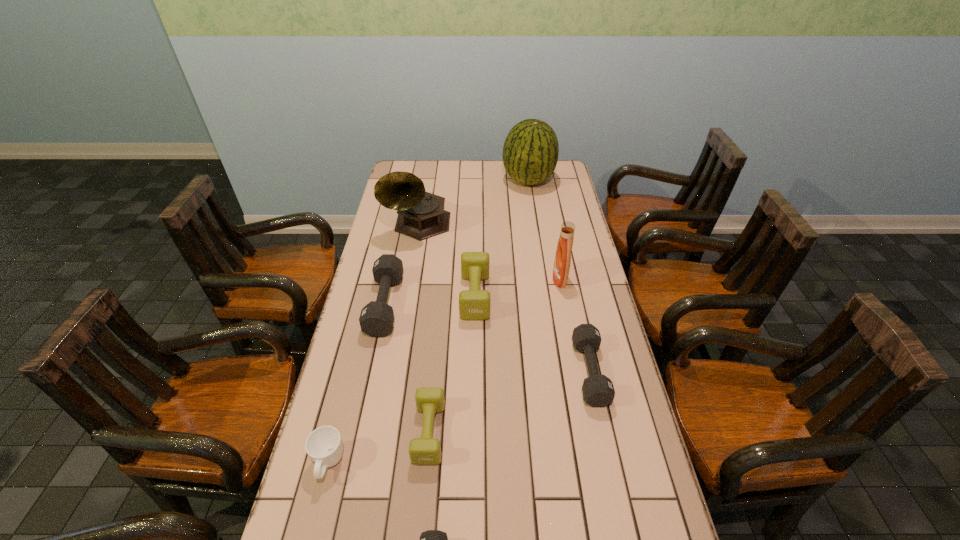
At what (x,y) coordinates should I click in order to perform the action: click on the second biggest gray dumbbell. Please return your answer as a coordinate pair (x, y). Image resolution: width=960 pixels, height=540 pixels. Looking at the image, I should click on (598, 391).

Where is `the smaller olive dumbbell`? Image resolution: width=960 pixels, height=540 pixels. the smaller olive dumbbell is located at coordinates pos(426,450).

What are the coordinates of `the nearer olive dumbbell` in the screenshot? It's located at (426, 450).

This screenshot has height=540, width=960. Identify the location of vacant space located 0.110m on the left of the watermelon. (478, 180).

This screenshot has height=540, width=960. What are the coordinates of `free space located 0.180m on the horn direction of the phonograph record` in the screenshot? It's located at (409, 278).

Where is `vacant point located 0.100m on the front-facing side of the detergent`? The height and width of the screenshot is (540, 960). vacant point located 0.100m on the front-facing side of the detergent is located at coordinates (525, 279).

I want to click on vacant space situated 0.220m on the front-facing side of the detergent, so click(x=492, y=279).

You are a GUI agent. You are given a task and a screenshot of the screen. Output one action in this format:
    pyautogui.click(x=<x>, y=<y>)
    Task: Click on the free space located on the front-facing side of the detergent
    
    Given the screenshot: What is the action you would take?
    pyautogui.click(x=489, y=279)

In order to click on vacant space located on the front of the fourth dumbbell from left to right in this screenshot , I will do `click(473, 422)`.

At what (x,y) coordinates should I click in order to perform the action: click on vacant area situated on the back of the leftmost gray dumbbell. Please return your answer as a coordinate pair (x, y). This screenshot has width=960, height=540. Looking at the image, I should click on (400, 234).